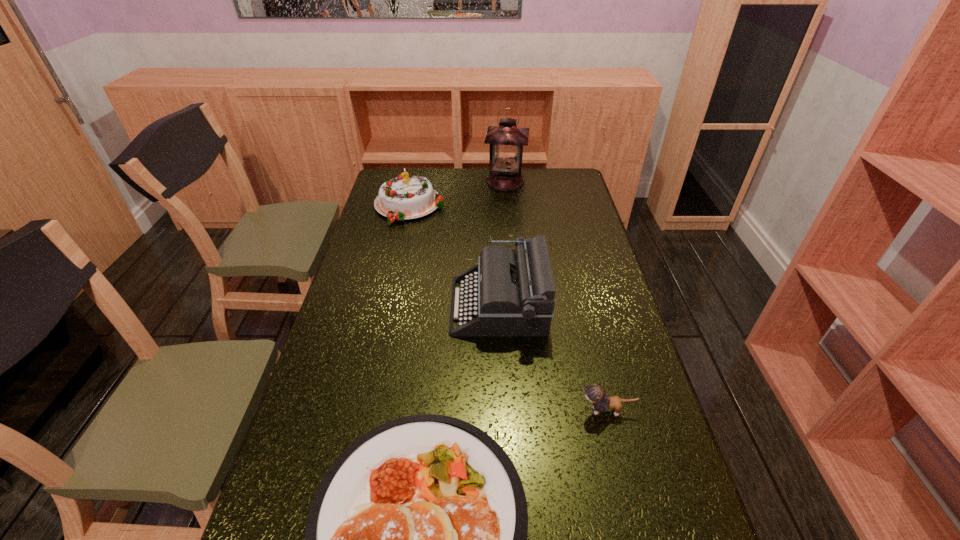
Find the location of a particular element. Image resolution: width=960 pixels, height=540 pixels. oil lamp is located at coordinates (506, 141).

Where is `typewriter`? typewriter is located at coordinates (x=514, y=292).

This screenshot has width=960, height=540. I want to click on cake, so pyautogui.click(x=406, y=197).

Where is `the rightmost object`? the rightmost object is located at coordinates (595, 394).

Where is `kitten`? kitten is located at coordinates (595, 394).

Image resolution: width=960 pixels, height=540 pixels. What are the coordinates of `free location located on the front of the tallest object` in the screenshot? It's located at (512, 247).

Locate an element on the screen. Image resolution: width=960 pixels, height=540 pixels. vacant space located on the typing side of the third nearest object is located at coordinates (377, 306).

This screenshot has height=540, width=960. Identify the location of vacant space located on the typing side of the third nearest object. (343, 306).

Where is `vacant space located 0.090m on the typing side of the third nearest object`? vacant space located 0.090m on the typing side of the third nearest object is located at coordinates (422, 306).

The height and width of the screenshot is (540, 960). Identify the location of free space located 0.160m on the back of the third tallest object. coord(418,170).